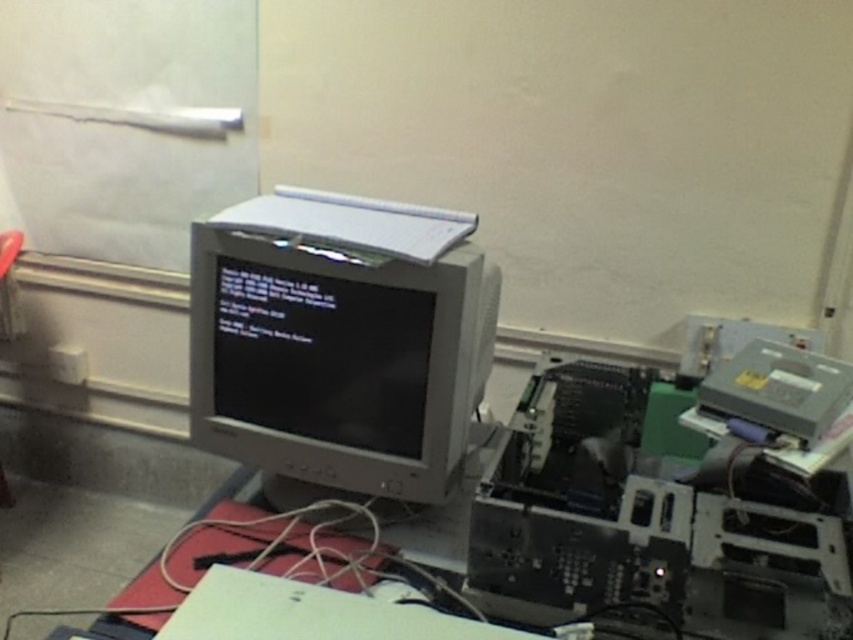
Locate an element on the screen. The height and width of the screenshot is (640, 853). matte gray monitor at center is located at coordinates (340, 339).

Can you confirm if matte gray monitor at center is shorter than gray plastic printer at right?

No, matte gray monitor at center is not shorter than gray plastic printer at right.

Image resolution: width=853 pixels, height=640 pixels. What do you see at coordinates (340, 339) in the screenshot?
I see `matte gray monitor at center` at bounding box center [340, 339].

Where is `matte gray monitor at center`? matte gray monitor at center is located at coordinates (340, 339).